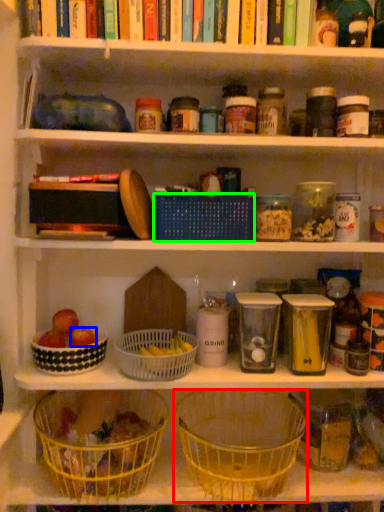
Question: Considering the real-world distances, which object is closest to basket (highlighted by a red box)? apple (highlighted by a blue box) or basket (highlighted by a green box).

Choices:
 (A) apple
 (B) basket

Answer: (A)